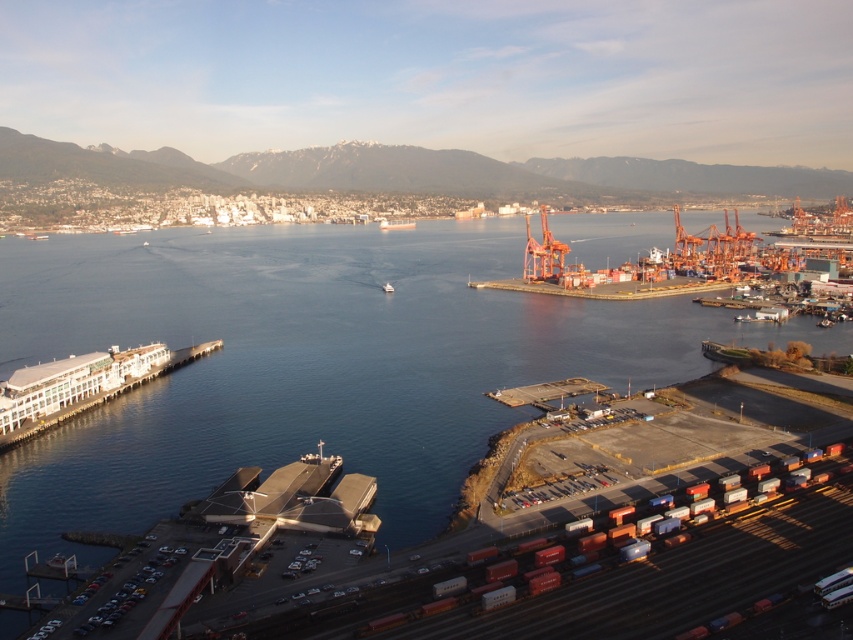
Question: Which point is closer to the camera?

Choices:
 (A) blue water at center
 (B) white plastic boat at center

Answer: (A)

Question: Can you confirm if blue water at center is thinner than white plastic boat at center?

Choices:
 (A) yes
 (B) no

Answer: (B)

Question: Which object is closer to the camera taking this photo?

Choices:
 (A) blue water at center
 (B) white plastic boat at center

Answer: (A)

Question: Is blue water at center wider than white plastic boat at center?

Choices:
 (A) yes
 (B) no

Answer: (A)

Question: Is blue water at center below white plastic boat at center?

Choices:
 (A) no
 (B) yes

Answer: (A)